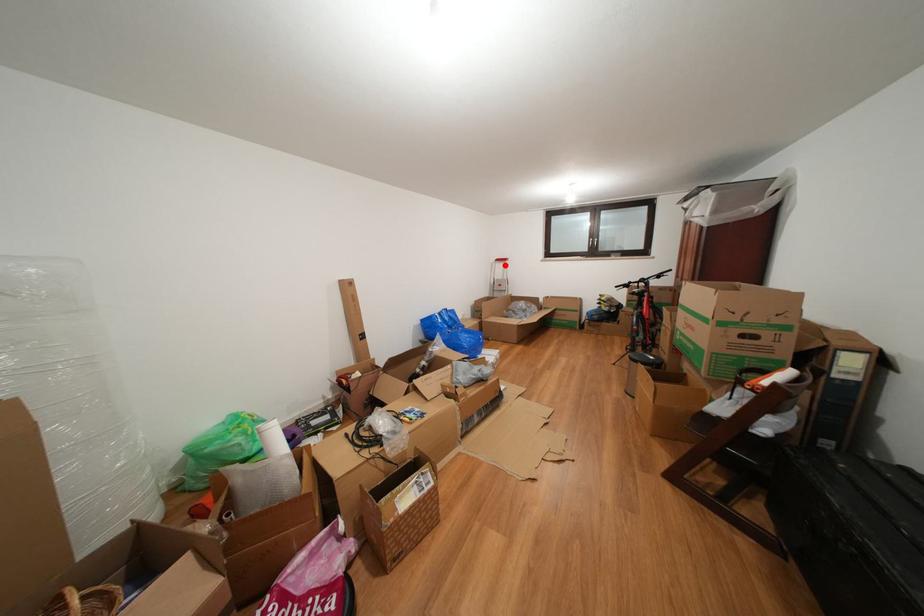
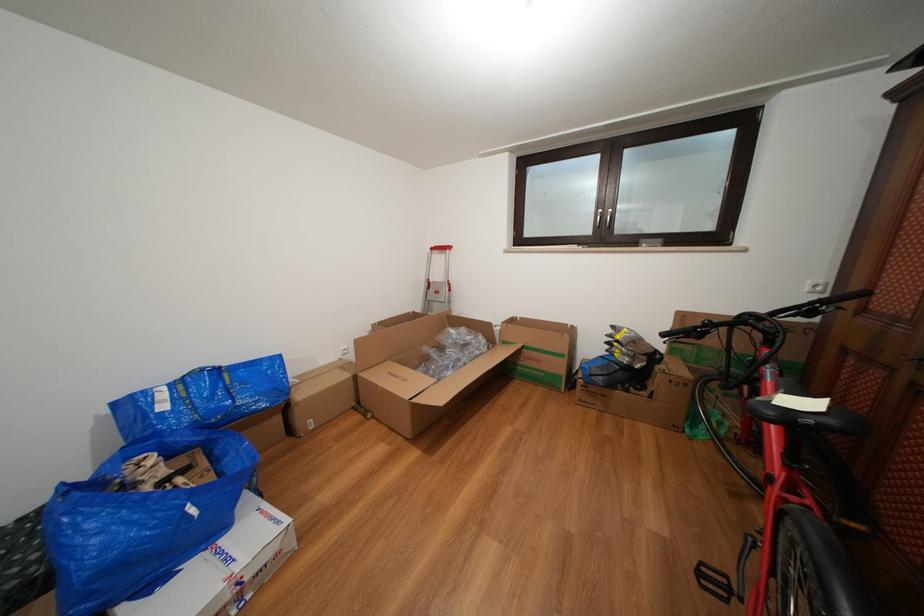
Locate, in the second image, the point that corresponds to the highlighted location in the first image.

(441, 254)